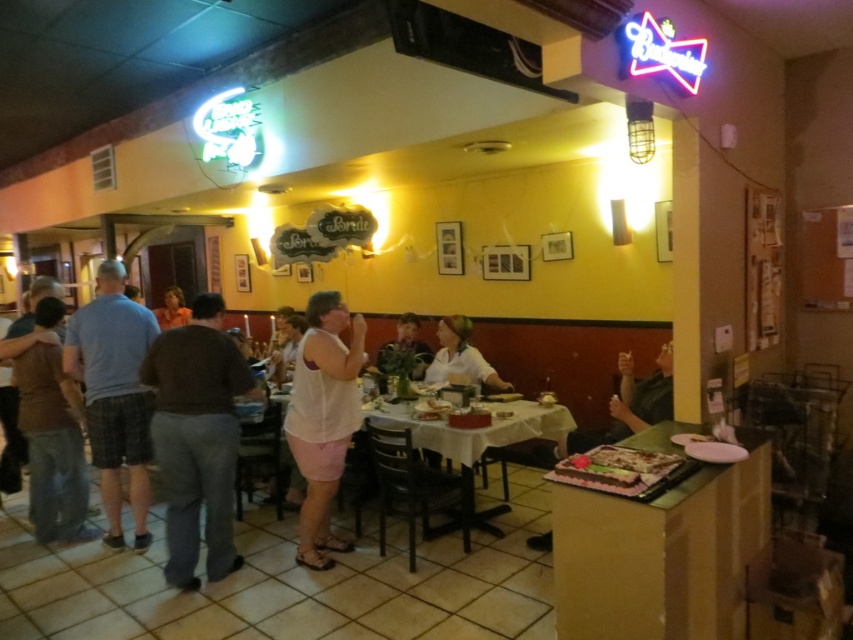
Question: Which point appears closest to the camera in this image?

Choices:
 (A) (735, 518)
 (B) (650, 483)

Answer: (B)

Question: Which object appears closest to the camera in this image?

Choices:
 (A) brown cotton shirt at center
 (B) white matte tank top at center
 (C) white tablecloth at center
 (D) gray plaid shorts at left

Answer: (A)

Question: Can you confirm if green fabric shirt at right is bigger than white matte shirt at center?

Choices:
 (A) no
 (B) yes

Answer: (A)

Question: Which point appears closest to the camera in this image?

Choices:
 (A) (167, 531)
 (B) (74, 406)

Answer: (A)

Question: Does brown denim jeans at left come behind green fabric shirt at right?

Choices:
 (A) no
 (B) yes

Answer: (B)

Question: Considering the relative positions of chocolate cake at right and brown denim jeans at left in the image provided, where is chocolate cake at right located with respect to brown denim jeans at left?

Choices:
 (A) above
 (B) below

Answer: (B)